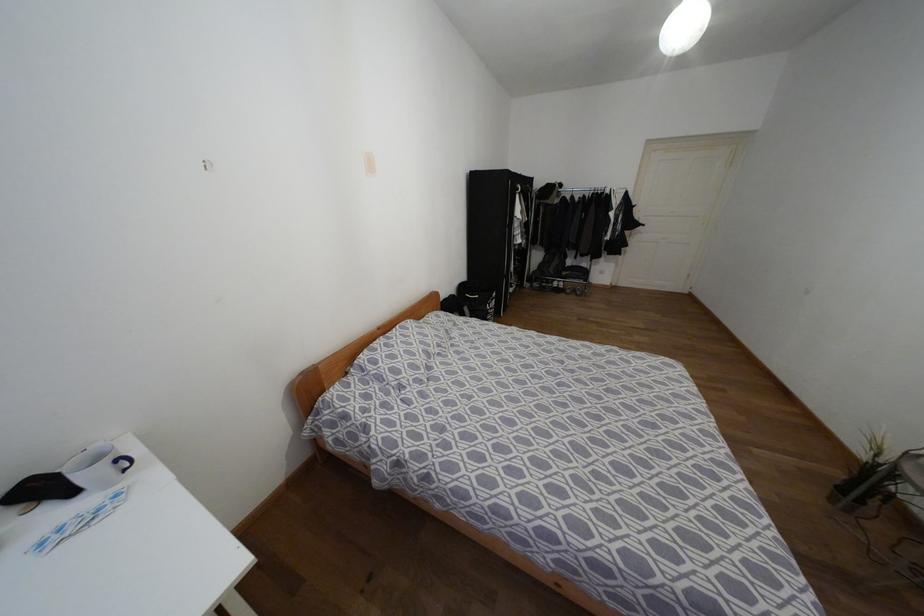
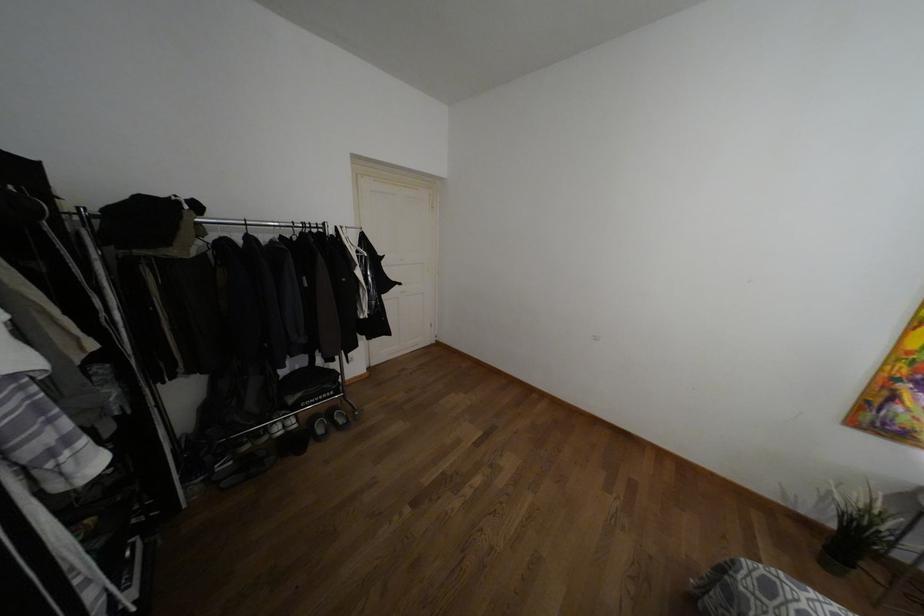
The point at (554,283) is marked in the first image. Where is the corresponding point in the second image?

(275, 427)